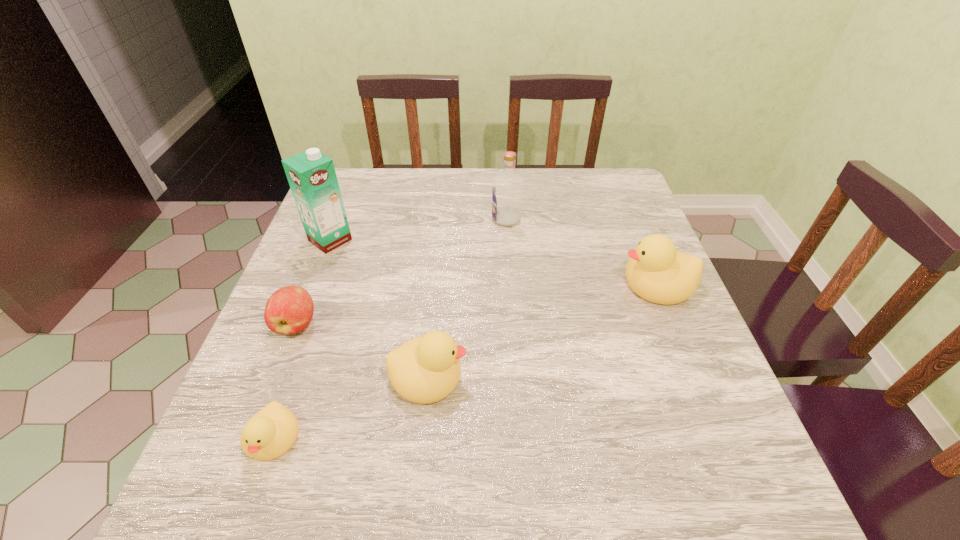
Where is `the shortest duckling`? the shortest duckling is located at coordinates (271, 432).

Find the location of a particular element. This screenshot has height=540, width=960. the shortest object is located at coordinates (271, 432).

The image size is (960, 540). In order to click on the fourth object from left to right in this screenshot , I will do `click(426, 369)`.

Locate an element on the screen. The height and width of the screenshot is (540, 960). the second farthest duckling is located at coordinates (x=426, y=369).

Identify the location of the farthest duckling. The height and width of the screenshot is (540, 960). (x=656, y=271).

Where is `the rightmost duckling`? The height and width of the screenshot is (540, 960). the rightmost duckling is located at coordinates (656, 271).

Where is `the fifth shortest object`? The image size is (960, 540). the fifth shortest object is located at coordinates (507, 192).

You are a GUI agent. You are given a task and a screenshot of the screen. Output one action in this format:
    pyautogui.click(x=<x>, y=<y>)
    Task: Click on the fifth object from left to right
    Image resolution: width=960 pixels, height=540 pixels.
    Given the screenshot: What is the action you would take?
    pyautogui.click(x=507, y=192)

Identify the location of the tallest object. (311, 175).

Locate an element on the screen. The width and height of the screenshot is (960, 540). apple is located at coordinates (289, 310).